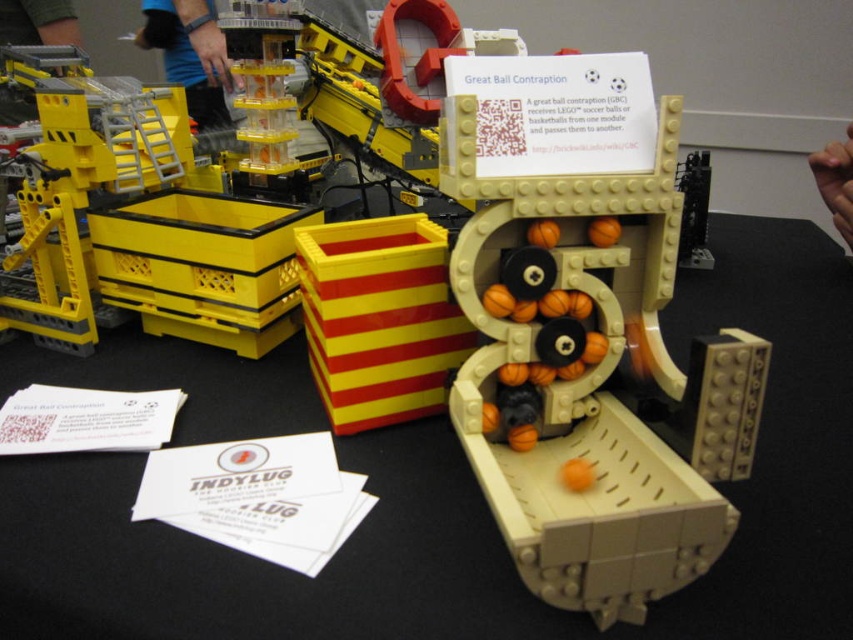
Is beige plastic table at center positioned at the back of beige plastic ball pit at center?

Yes, it is behind beige plastic ball pit at center.

Can you confirm if beige plastic table at center is positioned to the right of beige plastic ball pit at center?

Yes, beige plastic table at center is to the right of beige plastic ball pit at center.

This screenshot has height=640, width=853. Find the location of `beige plastic table at center`. beige plastic table at center is located at coordinates (480, 508).

Does beige plastic ball pit at center appear over yellow plastic container at left?

Actually, beige plastic ball pit at center is below yellow plastic container at left.

Consider the image. Can you confirm if beige plastic ball pit at center is positioned to the left of yellow plastic container at left?

In fact, beige plastic ball pit at center is to the right of yellow plastic container at left.

Is point (473, 460) in front of point (171, 260)?

Yes, point (473, 460) is closer to viewer.

This screenshot has height=640, width=853. Find the location of `beige plastic ball pit at center`. beige plastic ball pit at center is located at coordinates (587, 330).

Who is more distant from viewer, (x=134, y=611) or (x=79, y=353)?

Positioned behind is point (x=79, y=353).

Is point (54, 576) closer to camera compared to point (216, 182)?

That is True.

Is point (48, 566) farther from viewer compared to point (151, 260)?

That is False.

Locate an element on the screen. The width and height of the screenshot is (853, 640). beige plastic table at center is located at coordinates (480, 508).